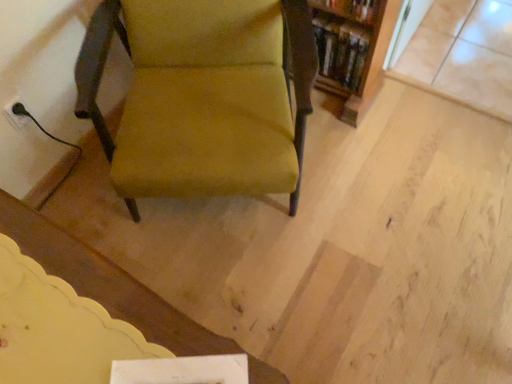
Find the location of a particular element. Image resolution: width=512 pixels, height=384 pixels. empty space that is ontop of wooden bookshelf at upper right (from a real-world perspective) is located at coordinates (341, 20).